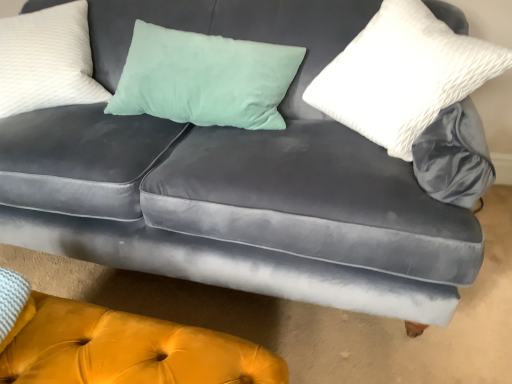
Question: In the image, is white textured pillow at upper left, the second pillow from the right, on the left side or the right side of velvet yellow ottoman at lower center?

Choices:
 (A) left
 (B) right

Answer: (A)

Question: From the image's perspective, is white textured pillow at upper left, positioned as the 1th pillow in left-to-right order, located above or below velvet yellow ottoman at lower center?

Choices:
 (A) above
 (B) below

Answer: (A)

Question: Which is nearer to the velvet yellow ottoman at lower center?

Choices:
 (A) white textured pillow at upper right, positioned as the 2th pillow in left-to-right order
 (B) white textured pillow at upper left, the second pillow from the right

Answer: (A)

Question: Considering the real-world distances, which object is farthest from the velvet yellow ottoman at lower center?

Choices:
 (A) white textured pillow at upper right, positioned as the 2th pillow in left-to-right order
 (B) white textured pillow at upper left, the second pillow from the right

Answer: (B)